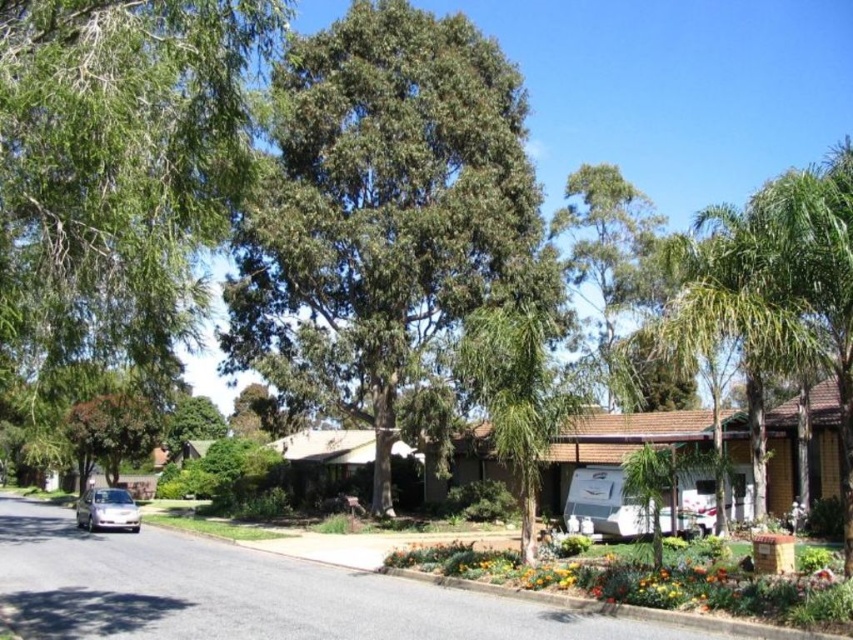
You are a bird looking for a nesting spot. You see the green leafy tree at left and the green leafy palm tree at right. Which tree is taller?

The green leafy palm tree at right is taller than the green leafy tree at left.

In the scene shown: You are a bird flying over the suburban street scene. You want to land on the closest green leafy tree. Which one should you choose between the green leafy tree at left and the green leafy tree at upper center?

The green leafy tree at left is closer to the viewer than the green leafy tree at upper center, so you should land on the green leafy tree at left.